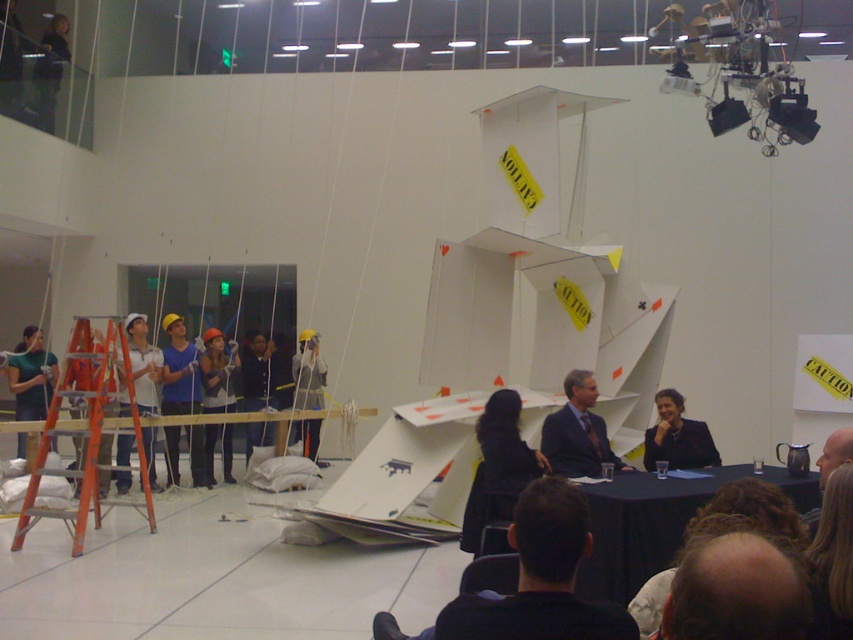
You are organizing a photoshoot and need to decide which piece of clothing to use as a prop. Both the black suit at center and the matte black jacket at center are available. Based on their sizes, which one would be more suitable for a mannequin that can only accommodate smaller garments?

The black suit at center has a smaller size compared to the matte black jacket at center, so it would be more suitable for the mannequin that can only accommodate smaller garments.